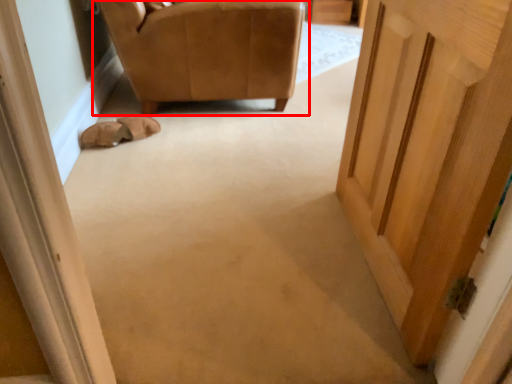
Question: From the image's perspective, what is the correct spatial relationship of chair (annotated by the red box) in relation to shoe?

Choices:
 (A) above
 (B) below

Answer: (A)